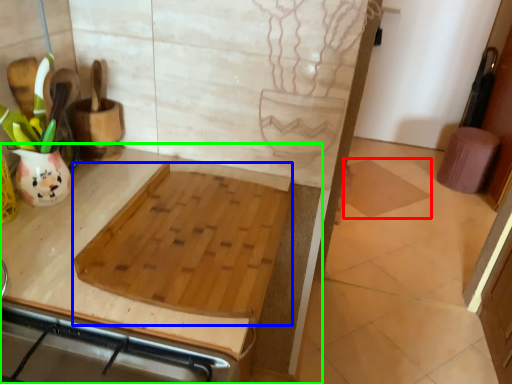
Question: Which object is the farthest from tile (highlighted by a red box)? Choose among these: cutting board (highlighted by a blue box) or countertop (highlighted by a green box).

Choices:
 (A) cutting board
 (B) countertop

Answer: (A)